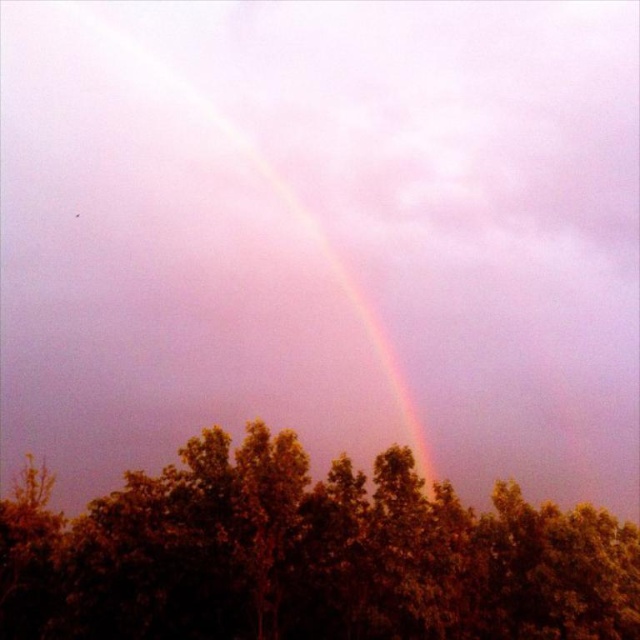
Does green leafy tree at center have a lesser height compared to rainbow at upper center?

Indeed, green leafy tree at center has a lesser height compared to rainbow at upper center.

Between green leafy tree at center and rainbow at upper center, which one appears on the right side from the viewer's perspective?

Positioned to the right is green leafy tree at center.

Does point (525, 547) come farther from viewer compared to point (168, 72)?

That is False.

I want to click on green leafy tree at center, so click(308, 556).